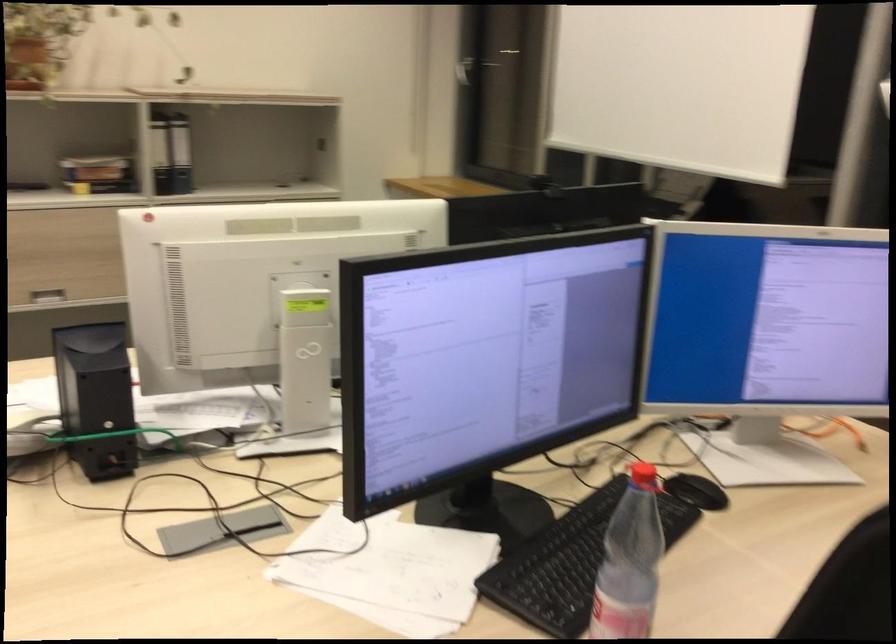
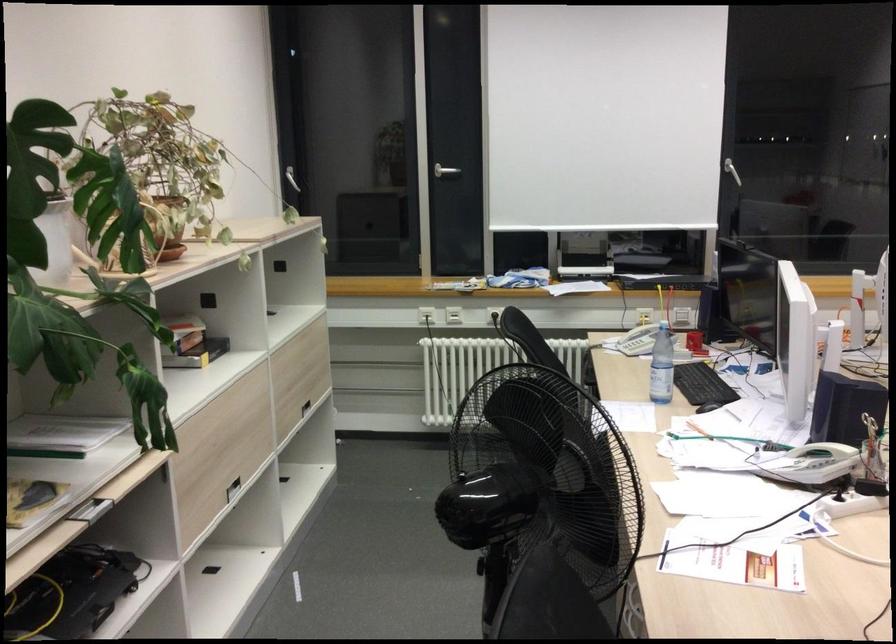
Question: I am providing you with two images of the same scene from different viewpoints. Please identify which objects are invisible in image2.

Choices:
 (A) black office binder
 (B) white window handle
 (C) plastic water bottle
 (D) toilet paper piece

Answer: (A)